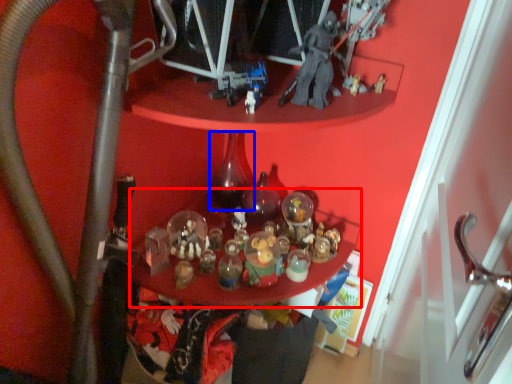
Question: Which point is closer to the camera, table (highlighted by a red box) or bottle (highlighted by a blue box)?

Choices:
 (A) table
 (B) bottle

Answer: (A)